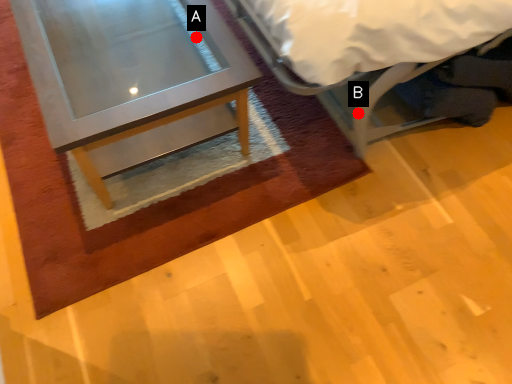
Question: Two points are circled on the image, labeled by A and B beside each circle. Which of the following is the closest to the observer?

Choices:
 (A) A is closer
 (B) B is closer

Answer: (B)